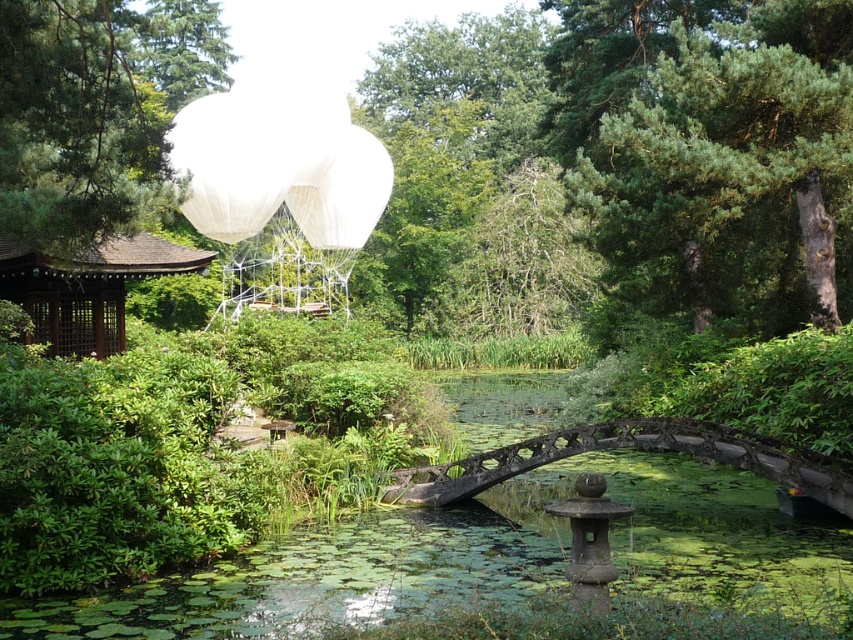
Which of these two, green pine tree at upper left or white matte balloon at center, stands shorter?

With less height is white matte balloon at center.

Is green pine tree at upper left further to camera compared to white matte balloon at center?

No.

This screenshot has height=640, width=853. Identify the location of green pine tree at upper left. (76, 125).

Looking at this image, is rusty metal bridge at center positioned at the back of white matte balloon at center?

No, rusty metal bridge at center is in front of white matte balloon at center.

Does rusty metal bridge at center appear over white matte balloon at center?

Actually, rusty metal bridge at center is below white matte balloon at center.

The height and width of the screenshot is (640, 853). Describe the element at coordinates (631, 448) in the screenshot. I see `rusty metal bridge at center` at that location.

Identify the location of rusty metal bridge at center. This screenshot has height=640, width=853. (631, 448).

Does green textured tree at upper right appear over brown wooden gazebo at left?

Yes, green textured tree at upper right is above brown wooden gazebo at left.

Is green textured tree at upper right to the left of brown wooden gazebo at left from the viewer's perspective?

No, green textured tree at upper right is not to the left of brown wooden gazebo at left.

The height and width of the screenshot is (640, 853). Find the location of `green textured tree at upper right`. green textured tree at upper right is located at coordinates (717, 154).

Locate an element on the screen. This screenshot has height=640, width=853. green textured tree at upper right is located at coordinates (717, 154).